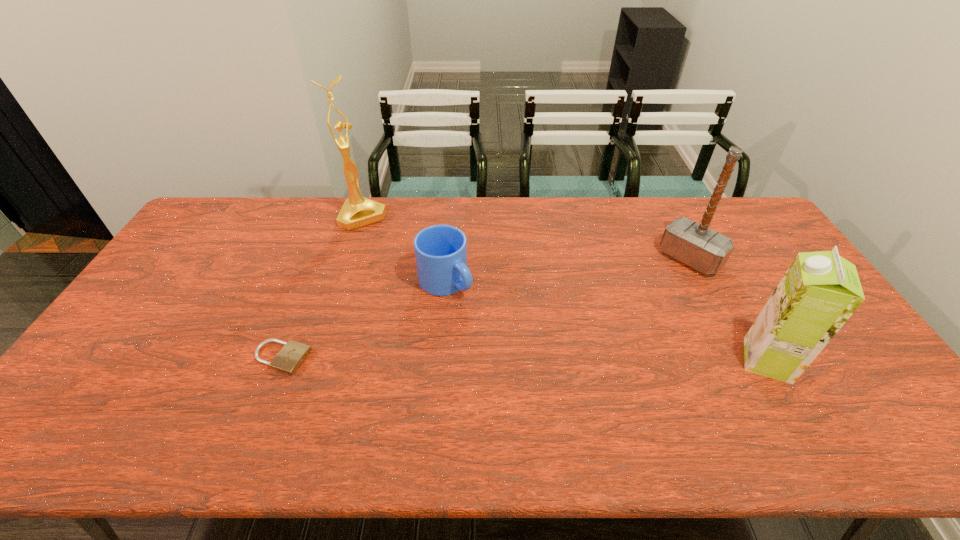
This screenshot has width=960, height=540. In order to click on free space at the far edge of the desktop in this screenshot , I will do `click(296, 214)`.

Where is `free location at the near edge`? This screenshot has height=540, width=960. free location at the near edge is located at coordinates (513, 381).

At what (x,y) coordinates should I click in order to perform the action: click on vacant space at the left edge of the desktop. Please return your answer as a coordinate pair (x, y). The width and height of the screenshot is (960, 540). Looking at the image, I should click on (217, 242).

Find the location of `vacant space at the far left corner of the desktop`. vacant space at the far left corner of the desktop is located at coordinates (235, 209).

This screenshot has width=960, height=540. In order to click on vacant region at the far right corner of the desktop in this screenshot , I will do `click(737, 212)`.

Where is `vacant region between the padlock and the farthest object`? vacant region between the padlock and the farthest object is located at coordinates (323, 287).

Image resolution: width=960 pixels, height=540 pixels. Find the location of `empty location between the soya milk and the hammer`. empty location between the soya milk and the hammer is located at coordinates (729, 309).

Where is `empty location between the second shortest object and the soya milk`? The image size is (960, 540). empty location between the second shortest object and the soya milk is located at coordinates (607, 321).

Locate an element on the screen. This screenshot has width=960, height=540. free spot between the padlock and the mug is located at coordinates (364, 320).

Identify the location of free space that is in between the hammer and the padlock. The width and height of the screenshot is (960, 540). (486, 308).